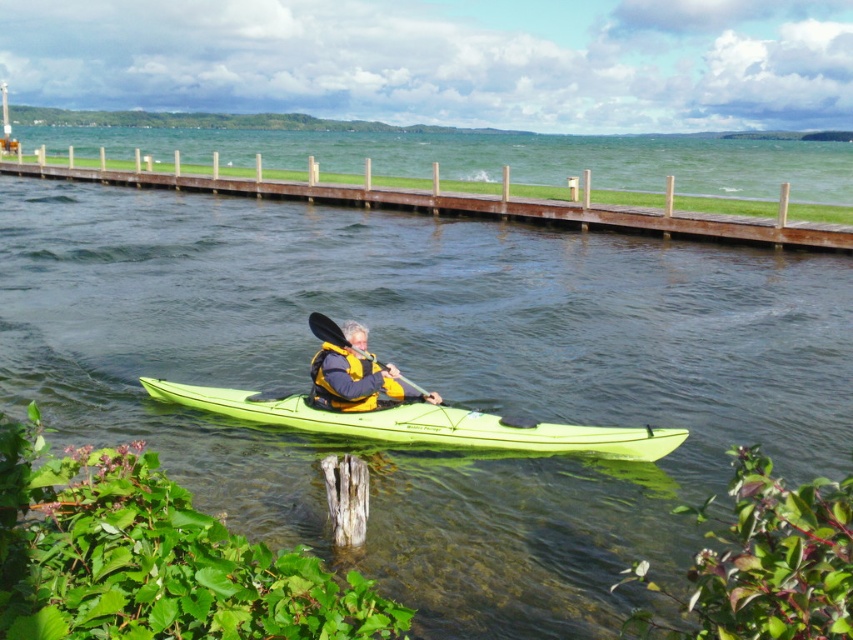
Question: Is the position of yellow life vest at center less distant than that of black textured paddle at center?

Choices:
 (A) yes
 (B) no

Answer: (A)

Question: Estimate the real-world distances between objects in this image. Which object is farther from the matte green kayak at center?

Choices:
 (A) brown wooden dock at upper center
 (B) black textured paddle at center
 (C) yellow life vest at center

Answer: (A)

Question: Is brown wooden dock at upper center bigger than black textured paddle at center?

Choices:
 (A) yes
 (B) no

Answer: (A)

Question: Which point is closer to the camera taking this photo?

Choices:
 (A) (581, 444)
 (B) (310, 323)
 (C) (323, 388)
 (D) (659, 224)

Answer: (A)

Question: Which object is closer to the camera taking this photo?

Choices:
 (A) matte green kayak at center
 (B) black textured paddle at center

Answer: (A)

Question: Can you confirm if matte green kayak at center is thinner than yellow life vest at center?

Choices:
 (A) no
 (B) yes

Answer: (A)